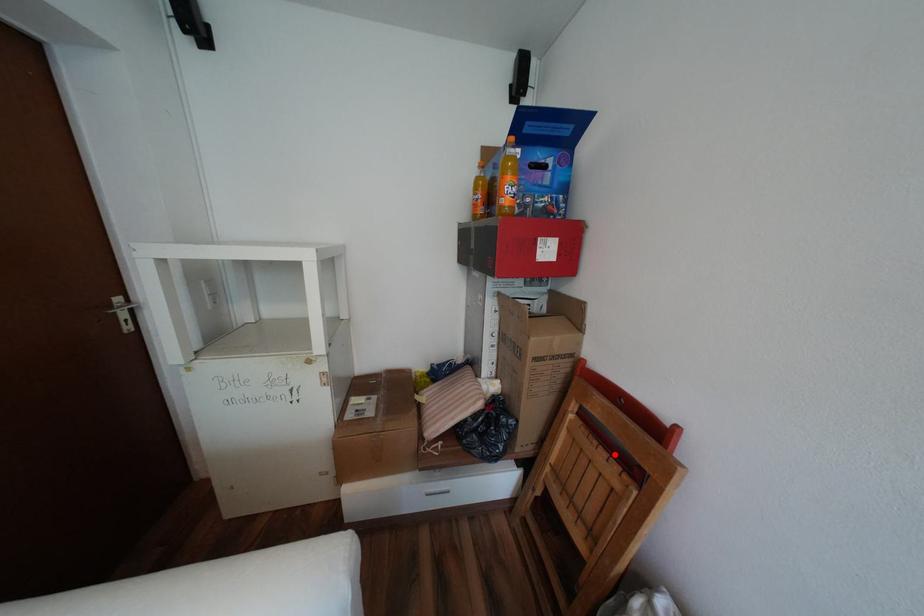
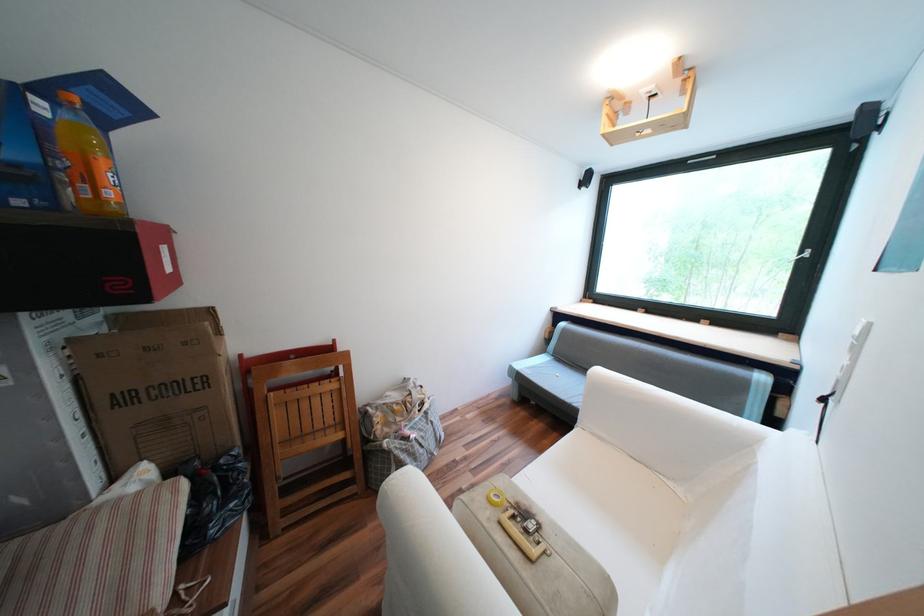
Find the pixel in the second image that matches the highlighted location in the first image.

(325, 383)